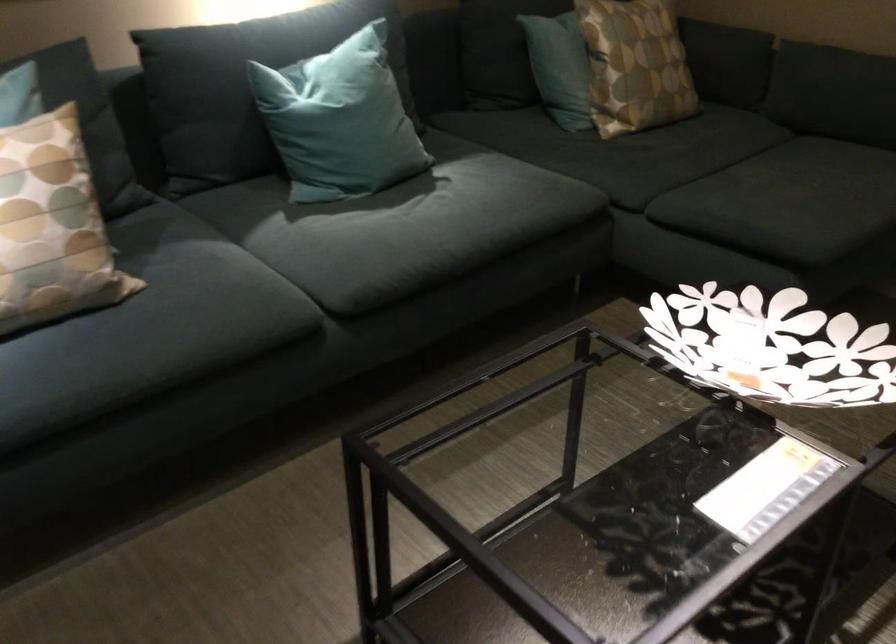
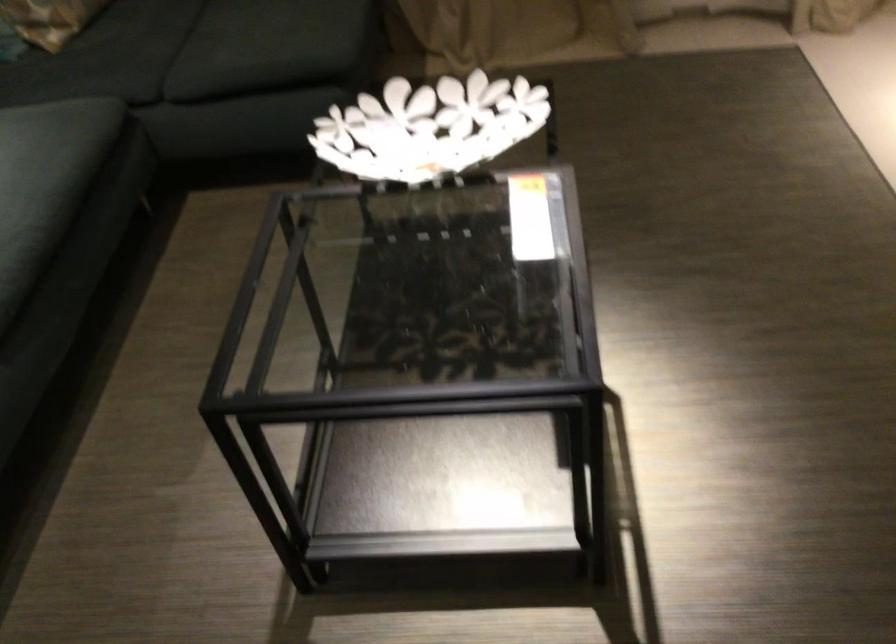
The point at (x=784, y=341) is marked in the first image. Where is the corresponding point in the second image?

(429, 127)